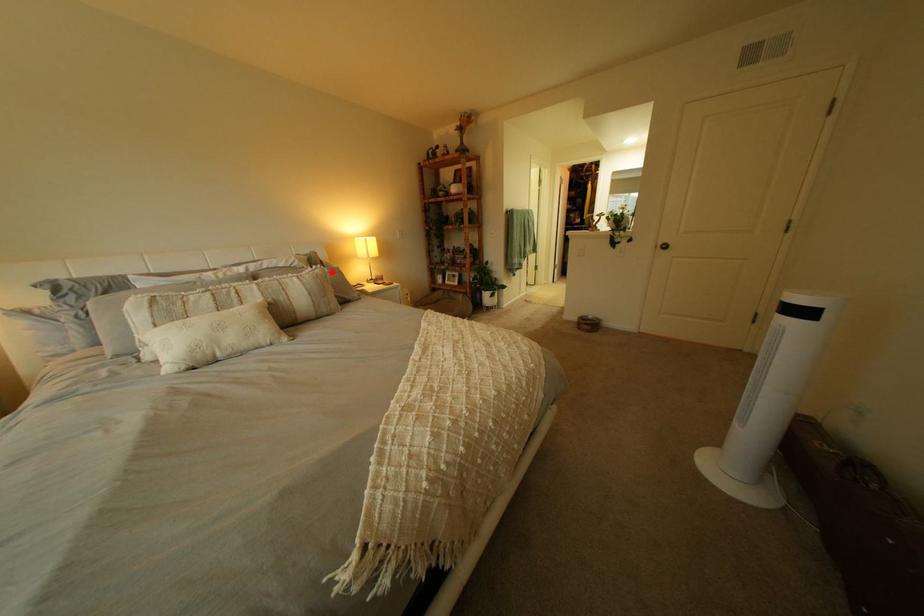
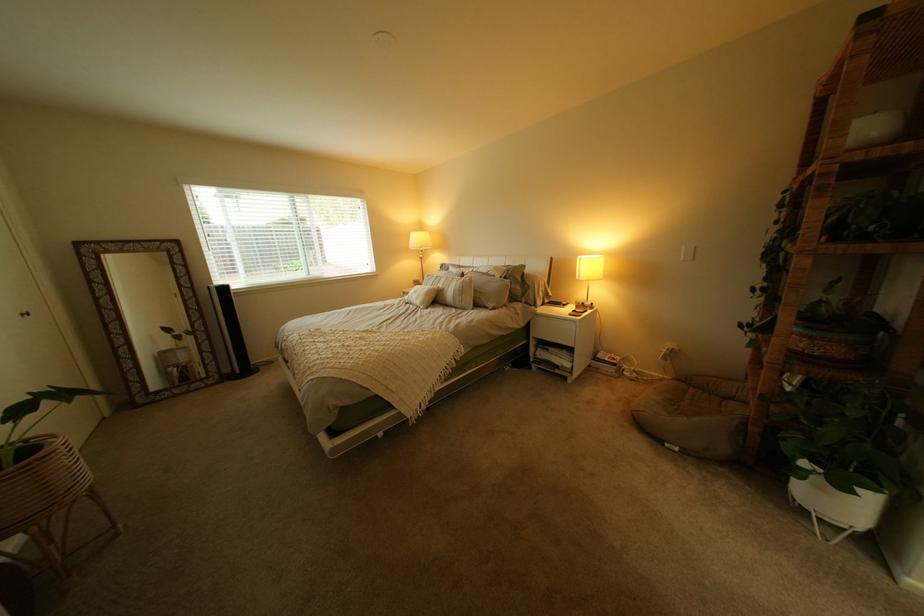
Question: I am providing you with two images of the same scene from different viewpoints. A red point is shown in image1. For the corresponding object point in image2, is it positioned nearer or farther from the camera?

Choices:
 (A) Nearer
 (B) Farther

Answer: (B)